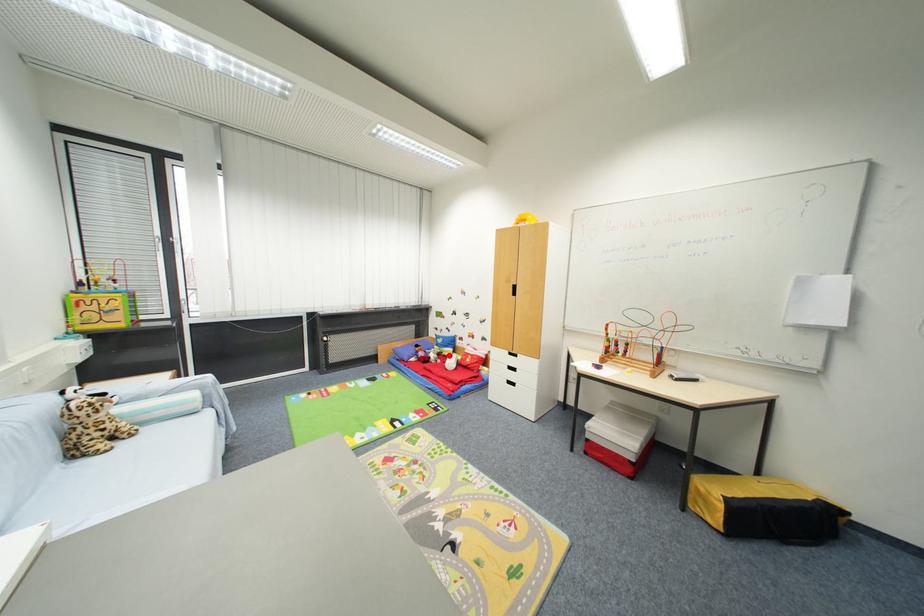
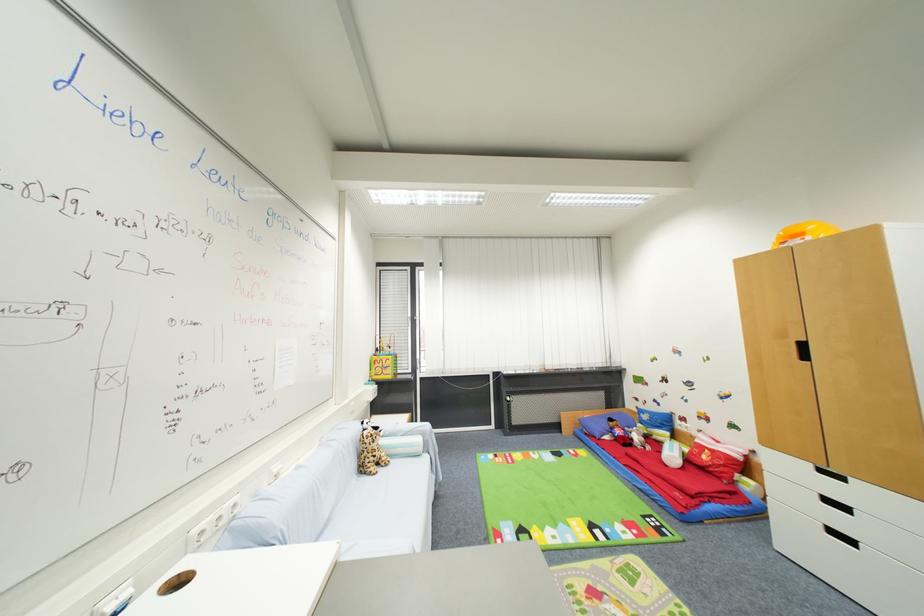
Question: A red point is marked in image1. In image2, is the corresponding 3D point closer to the camera or farther? Reply with the corresponding letter.

Choices:
 (A) The corresponding 3D point is closer.
 (B) The corresponding 3D point is farther.

Answer: (A)